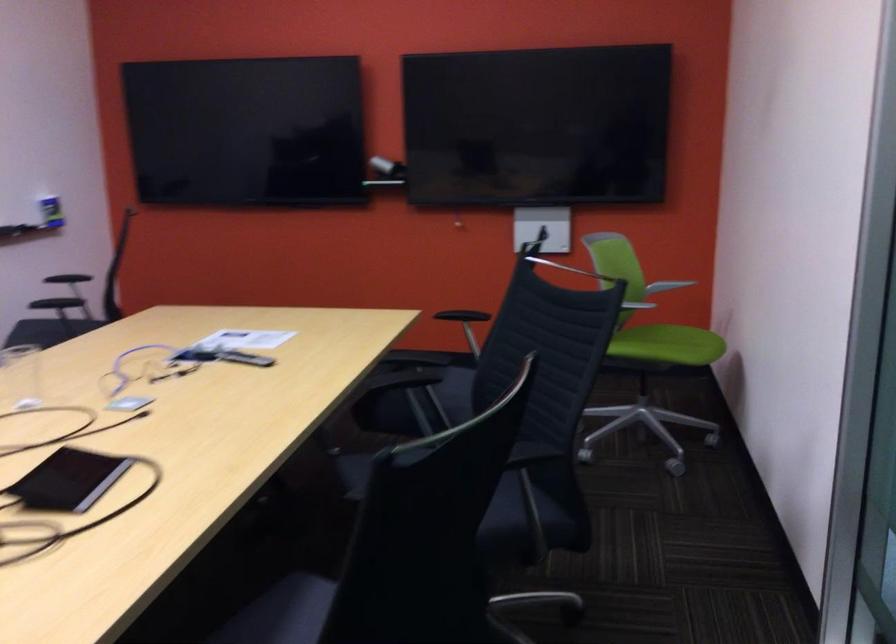
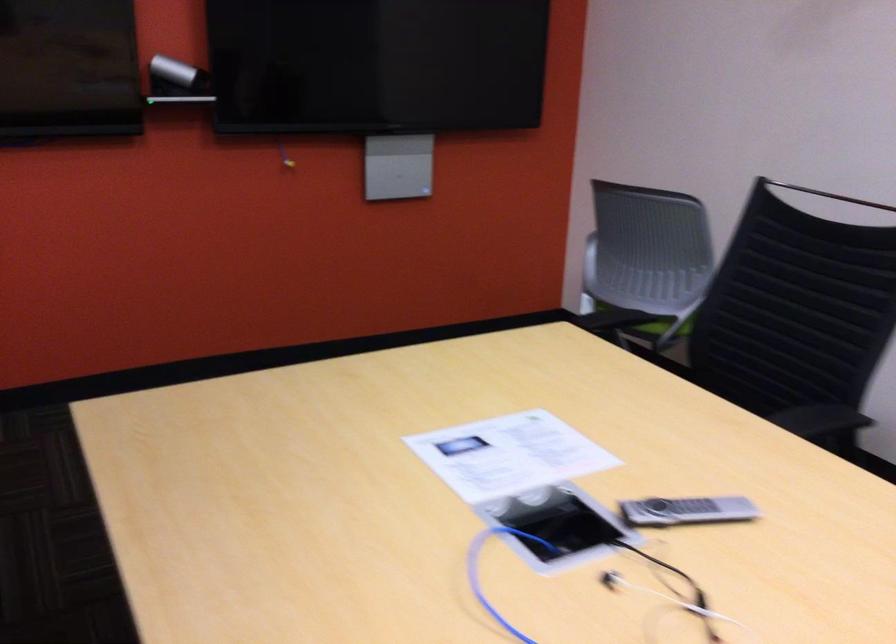
Question: I am providing you with two images of the same scene from different viewpoints. After the viewpoint changes to image2, which objects are now occluded?

Choices:
 (A) chair sitting surface
 (B) green chair armrest
 (C) black tablet
 (D) wheelchair wheel

Answer: (B)